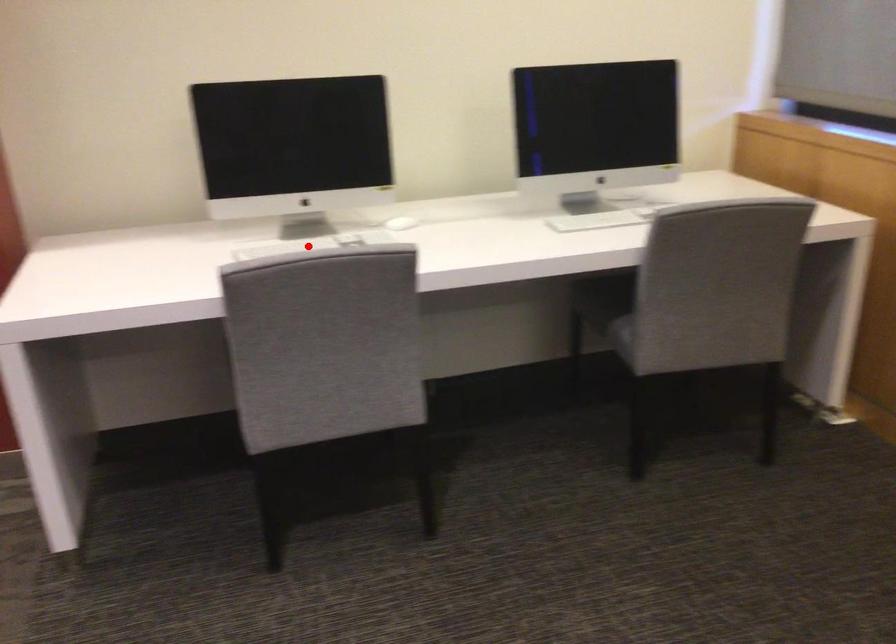
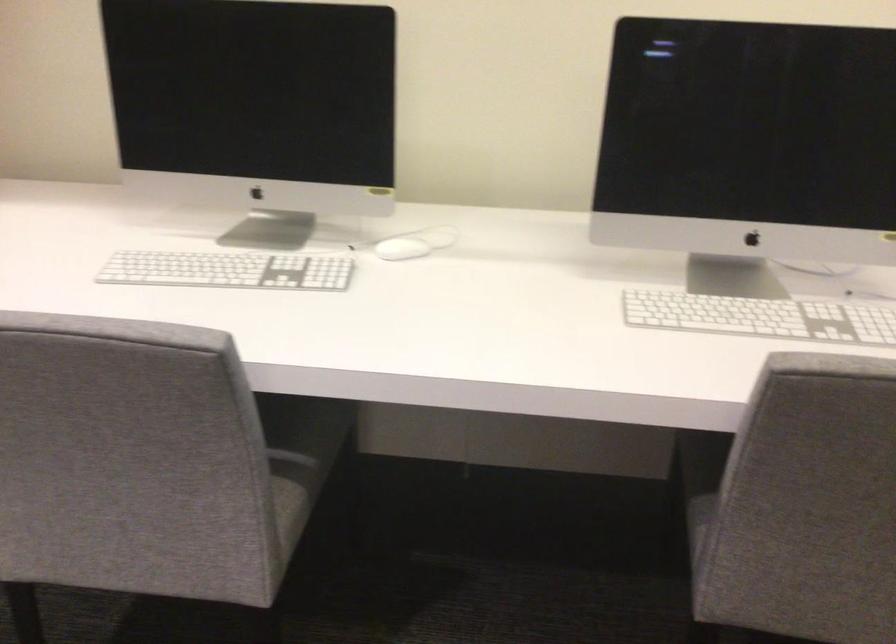
Question: A red point is marked in image1. In image2, is the corresponding 3D point closer to the camera or farther? Reply with the corresponding letter.

Choices:
 (A) The corresponding 3D point is closer.
 (B) The corresponding 3D point is farther.

Answer: (A)